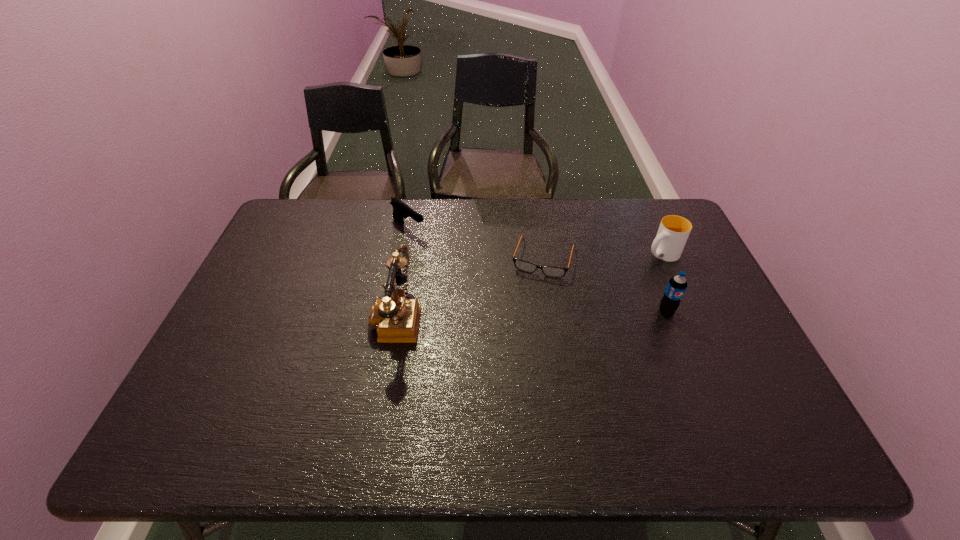
The height and width of the screenshot is (540, 960). I want to click on free space that is in between the telephone and the third object from right to left, so click(469, 287).

Locate an element on the screen. unoccupied area between the soda bottle and the pistol is located at coordinates (538, 269).

This screenshot has width=960, height=540. I want to click on free space between the shortest object and the second tallest object, so click(x=605, y=285).

Where is `vacant space in between the cup and the pistol`? The height and width of the screenshot is (540, 960). vacant space in between the cup and the pistol is located at coordinates (535, 241).

Where is `free space between the fourth shortest object and the spectacles`? Image resolution: width=960 pixels, height=540 pixels. free space between the fourth shortest object and the spectacles is located at coordinates (605, 285).

Find the location of a particular element. free space between the tallest object and the third tallest object is located at coordinates (529, 285).

I want to click on empty space between the fourth tallest object and the third tallest object, so click(535, 241).

The width and height of the screenshot is (960, 540). What are the coordinates of `vacant area that lies between the tallest object and the pistol` in the screenshot? It's located at (402, 272).

I want to click on vacant area that lies between the third object from right to left and the telephone, so click(469, 287).

Locate an element on the screen. Image resolution: width=960 pixels, height=540 pixels. free area in between the telephone and the third object from right to left is located at coordinates (469, 287).